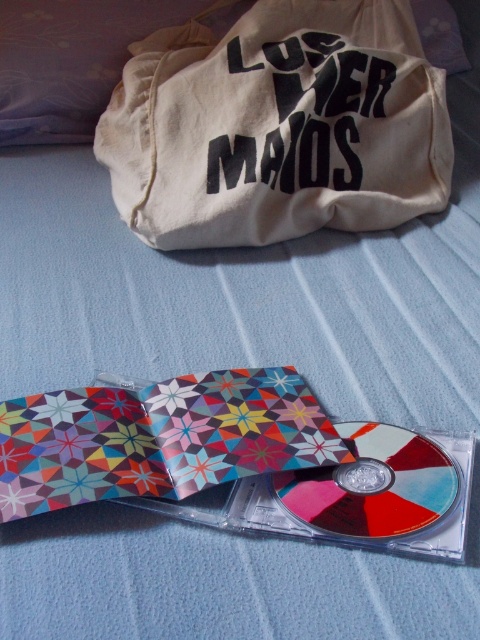
You are organizing items on a bed and need to place a new item between the beige canvas bag at upper center and the multicolored paper cd case at center. Based on their positions, which side of the cd case should you place the new item to ensure it is between them?

The beige canvas bag at upper center is to the right of the multicolored paper cd case at center, so to place the new item between them, you should position it to the left side of the cd case.

You are organizing a music collection and need to store the multicolored glossy cd at center properly. The multicolored paper cd case at center is the only available case. Can the cd fit inside the case?

The multicolored paper cd case at center is larger in size than the multicolored glossy cd at center, so the cd can fit inside the case.